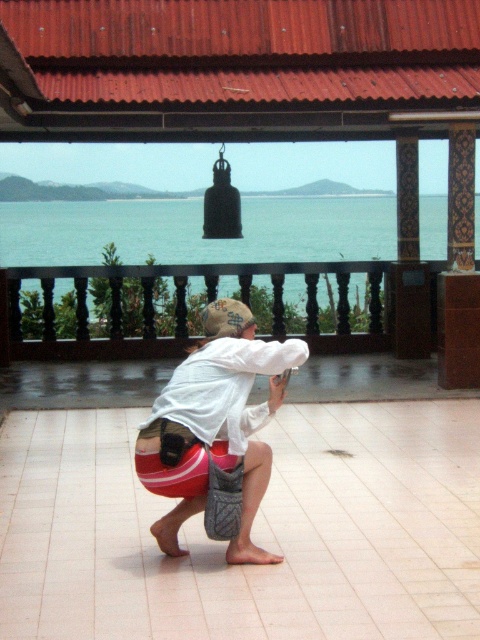
You are standing on the wooden railing and see the blue water at center and the red fabric bag at center. Which object is closer to you?

The blue water at center is closer to you because the red fabric bag at center is behind it.

You are standing at the wooden railing looking at the blue water at center and the red fabric bag at center. Which object is wider from your viewpoint?

The blue water at center is wider than the red fabric bag at center according to the description.

You are planning to take a photo of the blue water at center and the red fabric bag at center. Which object should you focus on first if you want to capture both in the same frame without moving the camera?

The blue water at center has a larger size compared to the red fabric bag at center, so you should focus on the blue water at center first to ensure it fills the frame appropriately before adjusting for the smaller red fabric bag at center.